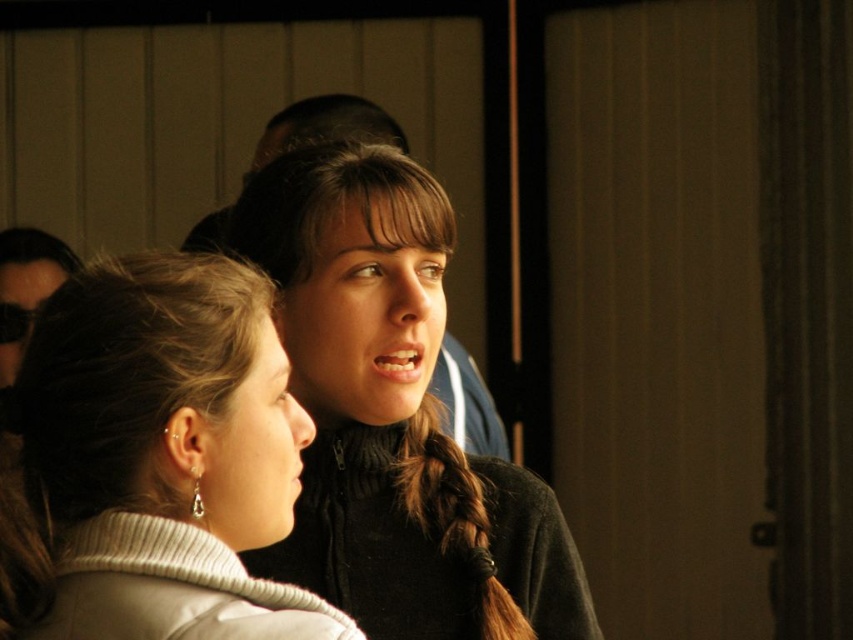
Can you confirm if white matte sweater at center is positioned to the right of brownbraided hair at center?

No, white matte sweater at center is not to the right of brownbraided hair at center.

Can you confirm if white matte sweater at center is taller than brownbraided hair at center?

Correct, white matte sweater at center is much taller as brownbraided hair at center.

Locate an element on the screen. This screenshot has height=640, width=853. white matte sweater at center is located at coordinates (158, 458).

I want to click on white matte sweater at center, so click(158, 458).

Which of these two, white matte sweater at center or black fuzzy sweater at center, stands taller?

black fuzzy sweater at center

Is the position of white matte sweater at center more distant than that of black fuzzy sweater at center?

No, white matte sweater at center is closer to the viewer.

From the picture: Who is more forward, (218,556) or (408,516)?

Positioned in front is point (218,556).

The height and width of the screenshot is (640, 853). Identify the location of white matte sweater at center. (158, 458).

Which is above, black fuzzy sweater at center or brownbraided hair at center?

black fuzzy sweater at center is higher up.

Identify the location of black fuzzy sweater at center. Image resolution: width=853 pixels, height=640 pixels. pos(393,417).